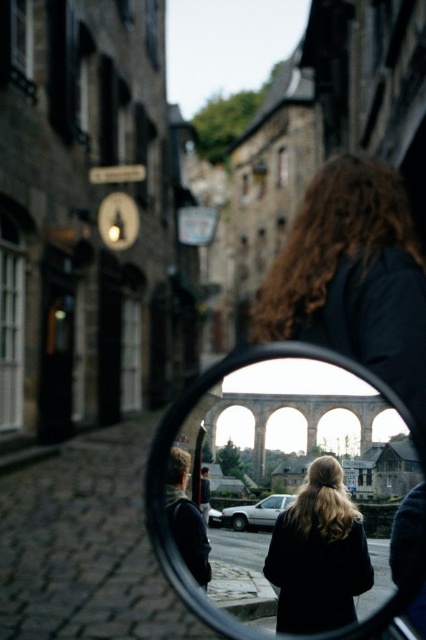
Question: Is clear glass mirror at center to the right of dark wool coat at center from the viewer's perspective?

Choices:
 (A) yes
 (B) no

Answer: (B)

Question: Is clear glass mirror at center thinner than dark wool coat at center?

Choices:
 (A) yes
 (B) no

Answer: (B)

Question: Among these objects, which one is nearest to the camera?

Choices:
 (A) dark wool coat at center
 (B) clear glass mirror at center

Answer: (B)

Question: In this image, where is clear glass mirror at center located relative to dark wool coat at center?

Choices:
 (A) left
 (B) right

Answer: (A)

Question: Which object is farther from the camera taking this photo?

Choices:
 (A) clear glass mirror at center
 (B) dark wool coat at center

Answer: (B)